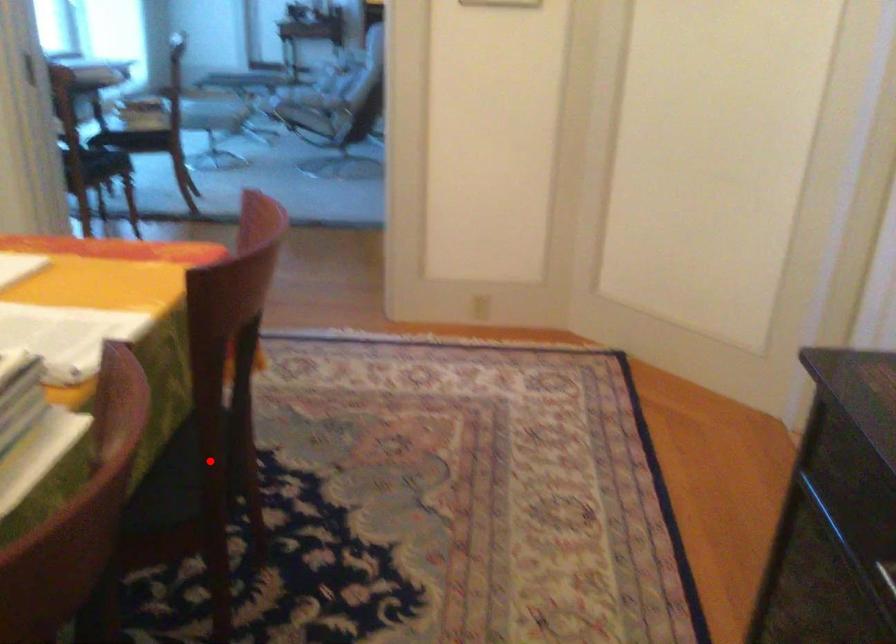
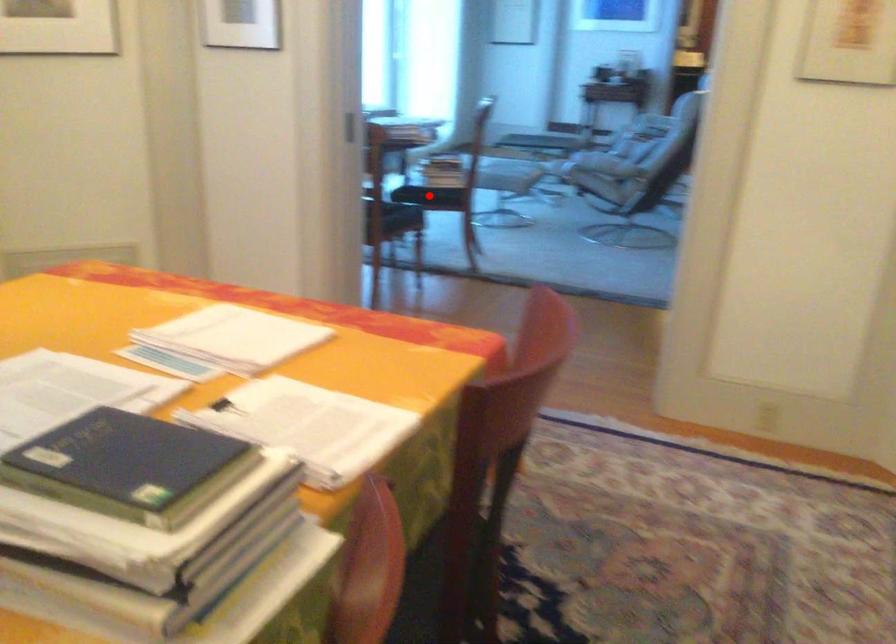
I am providing you with two images of the same scene from different viewpoints. A red point is marked on the first image and another point is marked on the second image. Do the highlighted points in image1 and image2 indicate the same real-world spot?

No